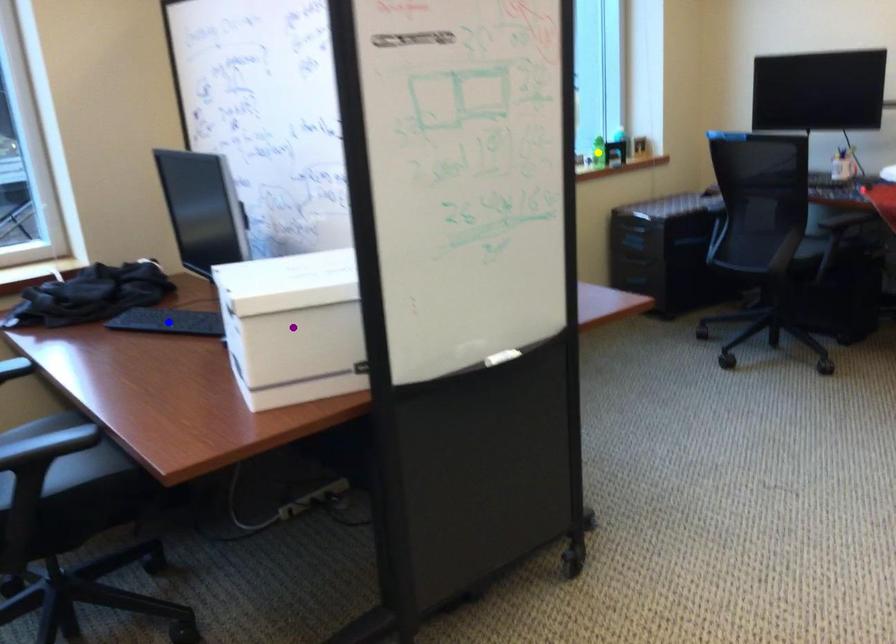
Order these from nearest to farthest:
blue point | yellow point | purple point

purple point, blue point, yellow point